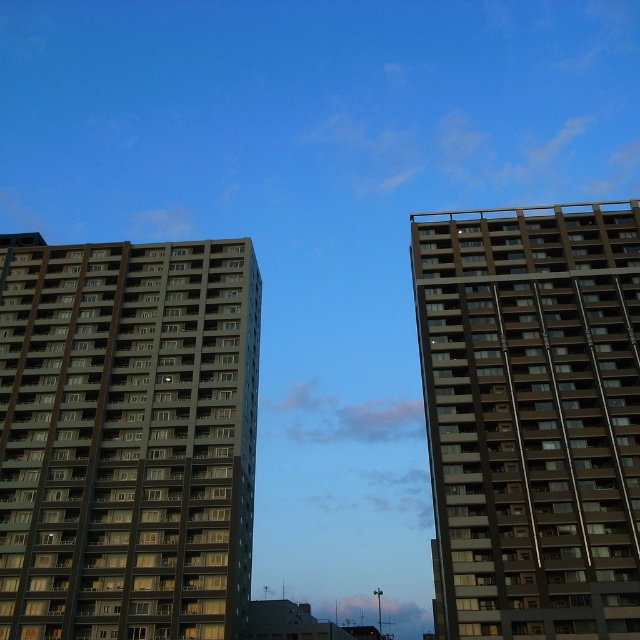
Question: Is dark gray concrete building at left wider than brown glassy building at right?

Choices:
 (A) yes
 (B) no

Answer: (A)

Question: Is dark gray concrete building at left below brown glassy building at right?

Choices:
 (A) no
 (B) yes

Answer: (A)

Question: Which of the following is the closest to the observer?

Choices:
 (A) brown glassy building at right
 (B) dark gray concrete building at left

Answer: (A)

Question: Which of the following is the closest to the observer?

Choices:
 (A) (40, 356)
 (B) (586, 250)

Answer: (A)

Question: Can you confirm if dark gray concrete building at left is thinner than brown glassy building at right?

Choices:
 (A) yes
 (B) no

Answer: (B)